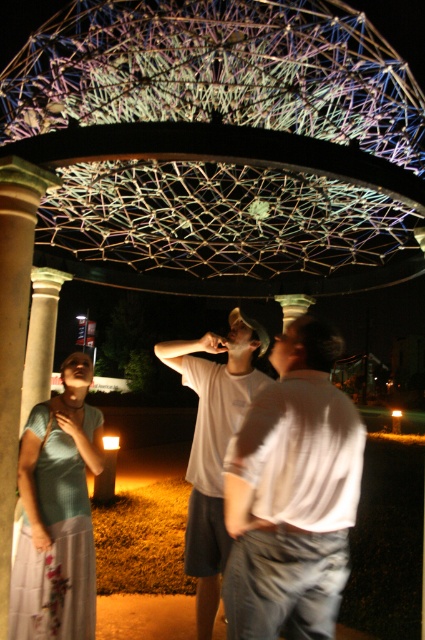
Question: Among these objects, which one is nearest to the camera?

Choices:
 (A) white cotton t-shirt at center
 (B) white matte t-shirt at center

Answer: (B)

Question: Which point appears closest to the camera in this image?

Choices:
 (A) (272, 540)
 (B) (206, 435)

Answer: (A)

Question: Is teal fabric blouse at center to the left of white cotton t-shirt at center from the viewer's perspective?

Choices:
 (A) yes
 (B) no

Answer: (A)

Question: Is white matte t-shirt at center closer to the viewer compared to white cotton t-shirt at center?

Choices:
 (A) yes
 (B) no

Answer: (A)

Question: Can you confirm if white matte t-shirt at center is wider than teal fabric blouse at center?

Choices:
 (A) yes
 (B) no

Answer: (A)

Question: Which object is the closest to the white cotton t-shirt at center?

Choices:
 (A) teal fabric blouse at center
 (B) white matte t-shirt at center

Answer: (A)